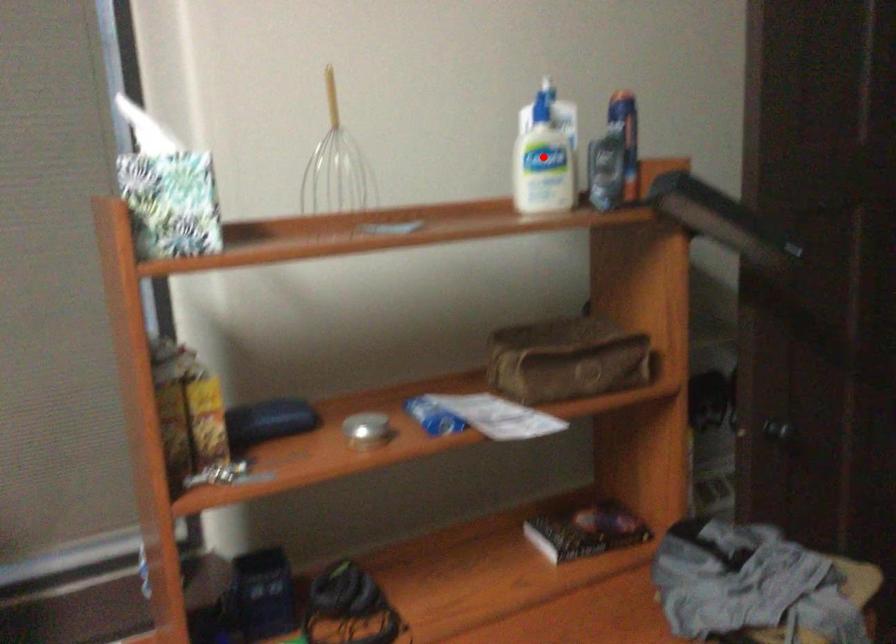
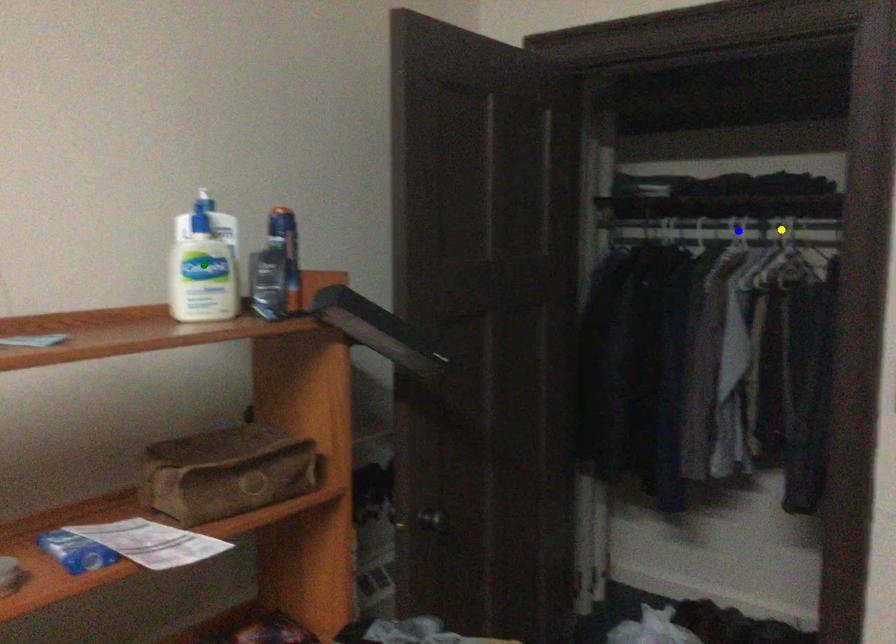
Question: I am providing you with two images of the same scene from different viewpoints. A red point is marked on the first image. You are given multiple points on the second image. Which mark in image 2 goes with the point in image 1?

Choices:
 (A) blue point
 (B) green point
 (C) yellow point

Answer: (B)